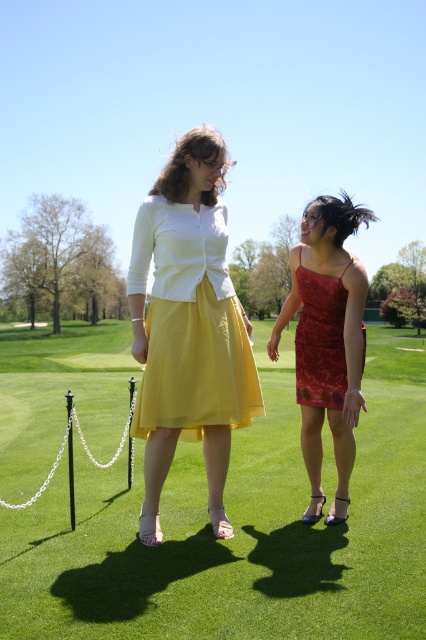
Which is more to the left, green grass at center or yellow chiffon skirt at center?

yellow chiffon skirt at center

Find the location of a particular element. The width and height of the screenshot is (426, 640). green grass at center is located at coordinates (236, 534).

Between green grass at center and matte red dress at center, which one is positioned lower?

green grass at center is lower down.

Who is more forward, (94,492) or (334,381)?

Point (334,381)

Is point (132, 540) behind point (328, 305)?

No, (132, 540) is in front of (328, 305).

This screenshot has height=640, width=426. In order to click on green grass at center in this screenshot , I will do `click(236, 534)`.

Based on the photo, can you confirm if shiny red dress at center is positioned to the right of matte red dress at center?

In fact, shiny red dress at center is to the left of matte red dress at center.

Can you confirm if shiny red dress at center is shorter than matte red dress at center?

No.

Does point (342, 252) lie behind point (331, 308)?

That is False.

This screenshot has height=640, width=426. In order to click on shiny red dress at center in this screenshot , I will do `click(327, 340)`.